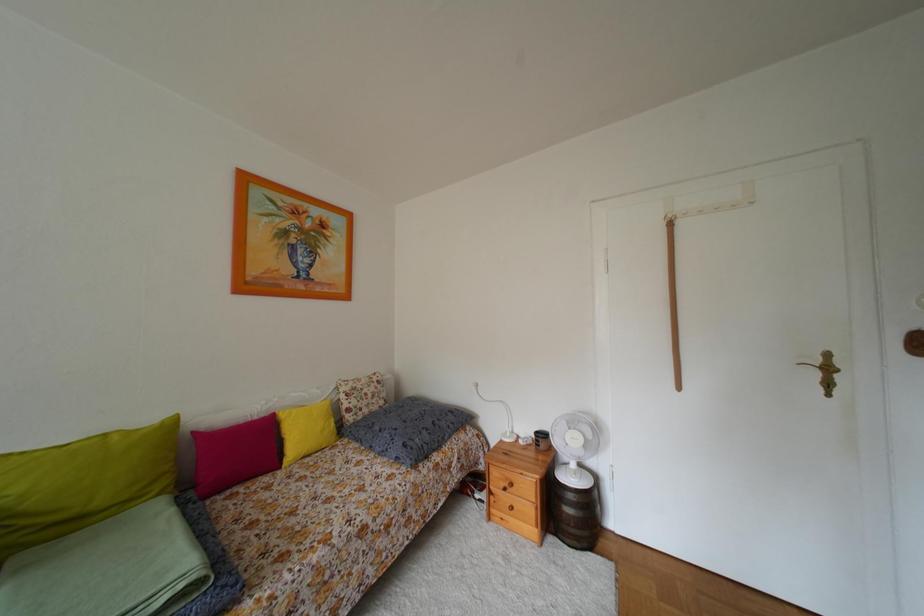
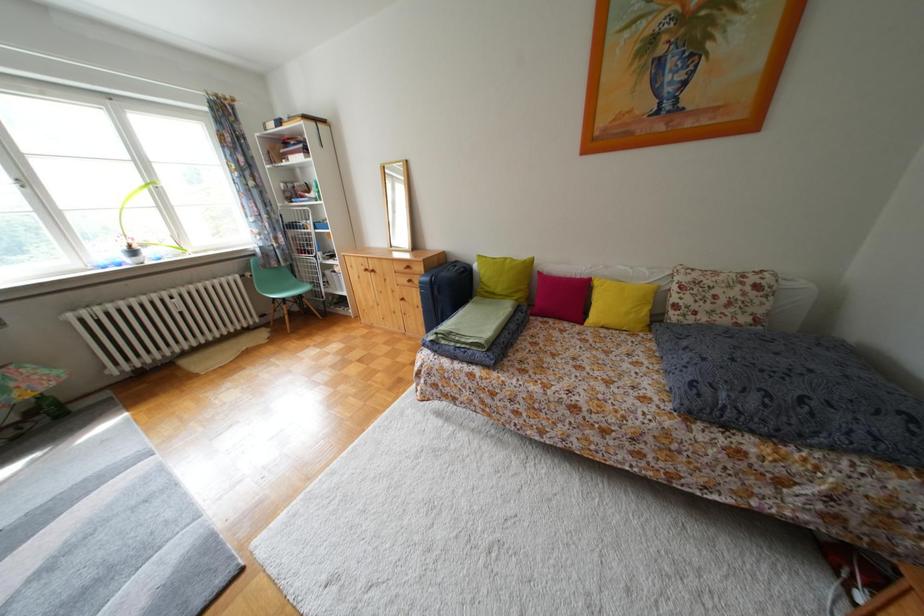
The images are taken continuously from a first-person perspective. In which direction is your viewpoint rotating?

The camera's rotation is toward left-down.